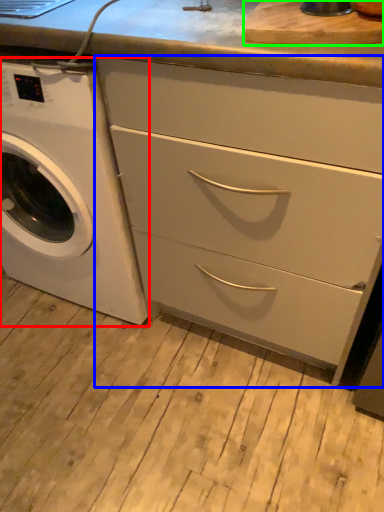
Question: Based on their relative distances, which object is farther from washing machine (highlighted by a red box)? Choose from chest of drawers (highlighted by a blue box) and cutting board (highlighted by a green box).

Choices:
 (A) chest of drawers
 (B) cutting board

Answer: (B)